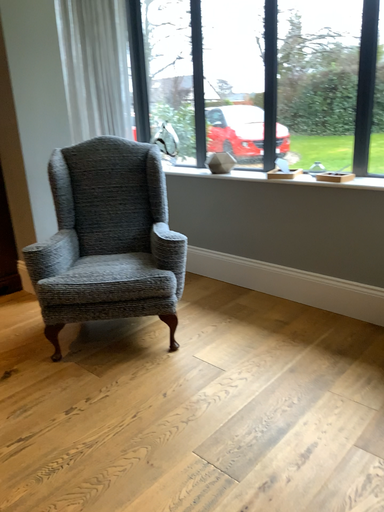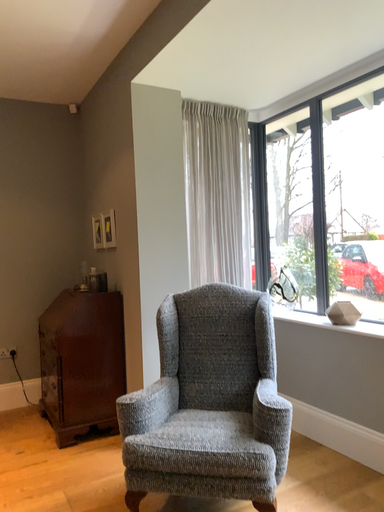
Question: Which way did the camera rotate in the video?

Choices:
 (A) rotated left
 (B) rotated right

Answer: (A)